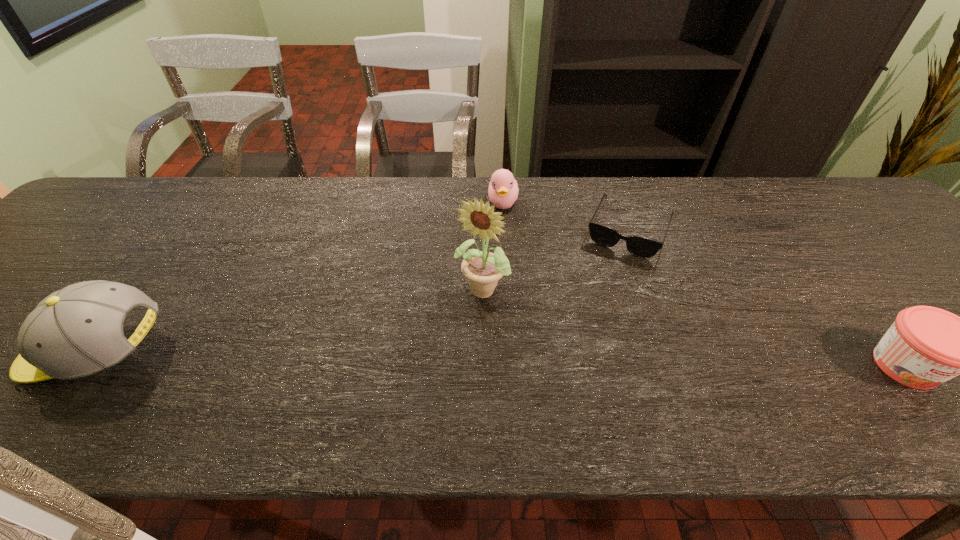
At what (x,y) coordinates should I click in order to perform the action: click on vacant space at the far right corner. Please return your answer as a coordinate pair (x, y). The image size is (960, 540). Looking at the image, I should click on (853, 218).

Locate an element on the screen. This screenshot has width=960, height=540. free space between the sunglasses and the duckling is located at coordinates (565, 217).

At what (x,y) coordinates should I click in order to perform the action: click on unoccupied area between the sunflower and the fourth object from left to right. Please return your answer as a coordinate pair (x, y). Looking at the image, I should click on 556,260.

This screenshot has height=540, width=960. Find the location of `free space that is in between the tallest object and the second object from right to left`. free space that is in between the tallest object and the second object from right to left is located at coordinates (556, 260).

Select which object is the second closest to the baseball cap. Please provide its 2D coordinates. Your answer should be formatted as a tuple, i.e. [(x, y)], where the tuple contains the x and y coordinates of a point satisfying the conditions above.

[(503, 190)]

Identify which object is the second closest to the second object from right to left. Please provide its 2D coordinates. Your answer should be formatted as a tuple, i.e. [(x, y)], where the tuple contains the x and y coordinates of a point satisfying the conditions above.

[(483, 269)]

Where is `free space in the image that satisfies the following two spatial constraints: 1. on the back side of the duckling; 2. on the left side of the sunflower`? free space in the image that satisfies the following two spatial constraints: 1. on the back side of the duckling; 2. on the left side of the sunflower is located at coordinates (482, 203).